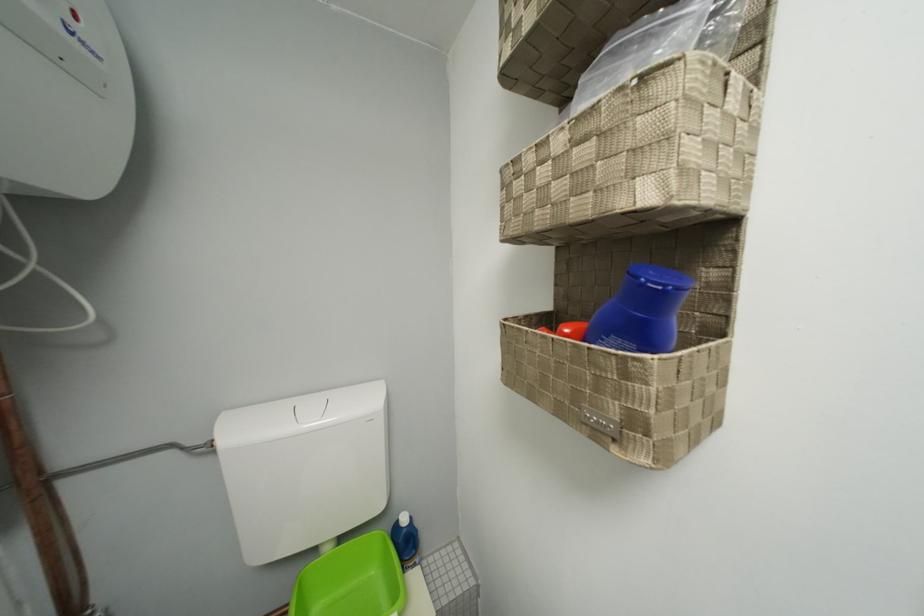
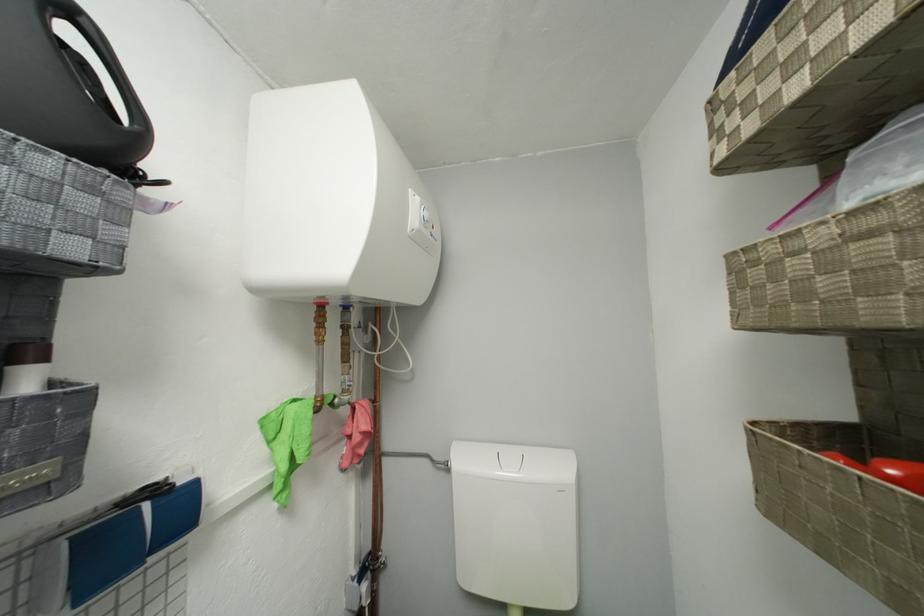
In the second image, find the point that corresponds to (566,146) in the first image.

(829, 238)